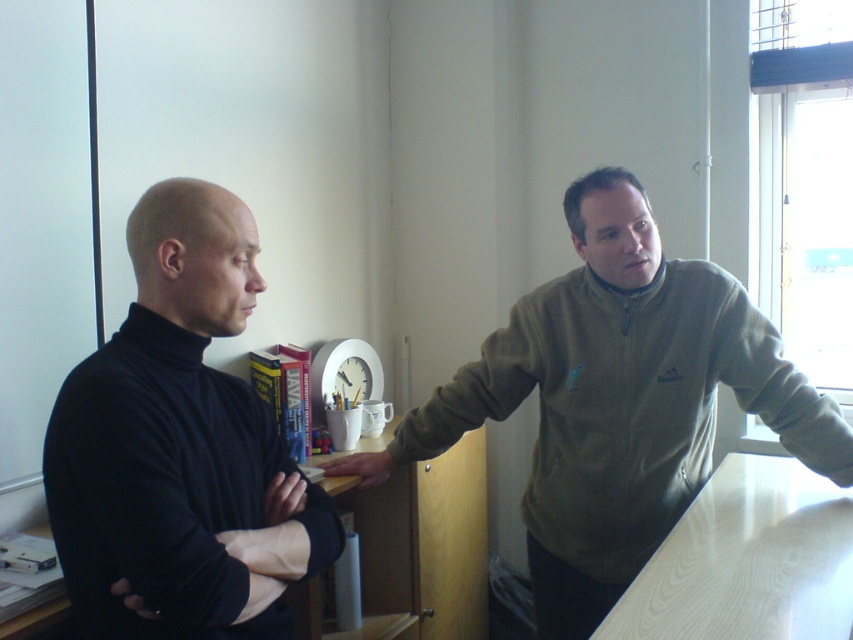
You are an office assistant who needs to deliver a pen to the person wearing the black turtleneck sweater at left. The black matte hand at lower left is holding a mug. Can you place the pen in the mug without the hand noticing?

The black turtleneck sweater at left is in front of the black matte hand at lower left, so placing the pen in the mug held by the hand would be possible as the sweater wearer is positioned in front and might not notice the hand moving.

You are standing in the office scene and want to place a small object on the smooth wooden desk at center. However, there is a black matte hand at lower left in the way. Can you move the object past the hand to reach the desk?

The smooth wooden desk at center is further to the viewer than the black matte hand at lower left, so the hand is closer to you. This means you can move the object past the hand to reach the desk since the desk is behind the hand.

Based on the photo, you are an office assistant who needs to place a new document on the smooth wooden desk at center. However, there is a black matte hand at lower left in the way. Can you place the document directly on the desk without moving the hand?

The smooth wooden desk at center is located above the black matte hand at lower left, so the hand is below the desk. Therefore, you can place the document directly on the desk without needing to move the hand.